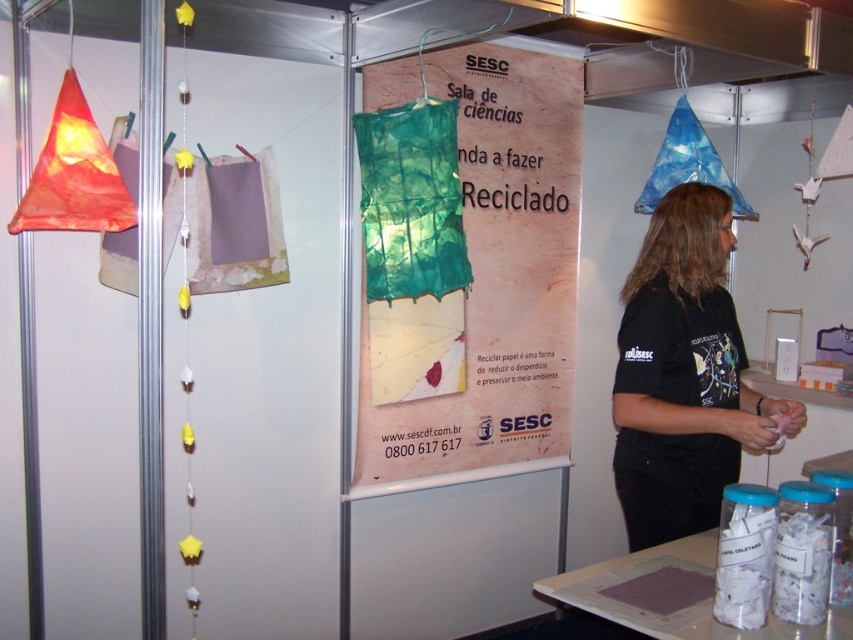
You are at an exhibition about recycling and see the green fabric lampshade at center and the black matte shirt at right. If you want to take a photo of both items together in one frame, will their current distance allow you to capture them without moving either item?

The green fabric lampshade at center and black matte shirt at right are 30.83 inches apart. Depending on your camera or phone lens and your position, 30.83 inches might be manageable if you step back slightly to include both in the frame. However, this depends on the focal length of your device. If the distance is too great for your device, you might need to move closer or use a wider angle lens.

You are standing in front of the banner at the recycling exhibition. There are two points marked on the banner, one at coordinates point (502, 266) and the other at point (634, 369). Which point is closer to you?

Point (502, 266) is further to the viewer than point (634, 369). Therefore, point (634, 369) is closer to you.

You are at an event about recycling and see a green fabric lampshade at center and a black matte shirt at right. Which object is taller?

The green fabric lampshade at center is much taller than the black matte shirt at right.